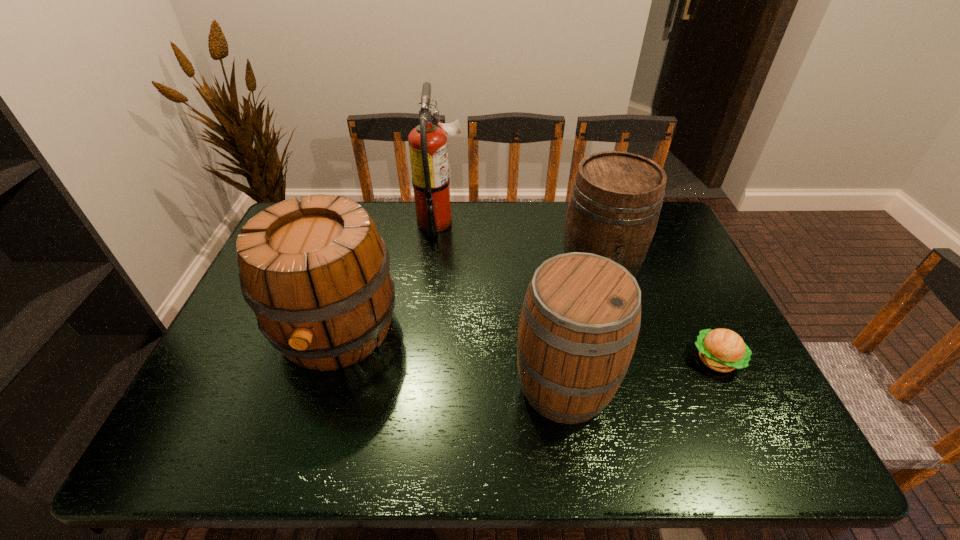
Find the location of a particular element. The height and width of the screenshot is (540, 960). object located at the near edge is located at coordinates (581, 315).

You are a GUI agent. You are given a task and a screenshot of the screen. Output one action in this format:
    pyautogui.click(x=<x>, y=<y>)
    Task: Click on the object located at the left edge
    
    Given the screenshot: What is the action you would take?
    pyautogui.click(x=316, y=274)

At what (x,y) coordinates should I click in order to perform the action: click on object situated at the right edge. Please return your answer as a coordinate pair (x, y). The width and height of the screenshot is (960, 540). Looking at the image, I should click on (723, 350).

The image size is (960, 540). In the image, there is a desktop. Identify the location of vacant region at the far edge. (510, 219).

Where is `free space at the near edge`? The image size is (960, 540). free space at the near edge is located at coordinates (450, 461).

In order to click on free space at the left edge of the desktop in this screenshot , I will do `click(216, 389)`.

This screenshot has height=540, width=960. What are the coordinates of `vacant point at the right edge` in the screenshot? It's located at (660, 251).

Find the location of a particular element. blank space at the far right corner is located at coordinates (x=664, y=242).

Image resolution: width=960 pixels, height=540 pixels. I want to click on object that is the second closest to the leftmost cider, so coord(581,315).

Where is `the second closest object to the shortest object`? The height and width of the screenshot is (540, 960). the second closest object to the shortest object is located at coordinates (581, 315).